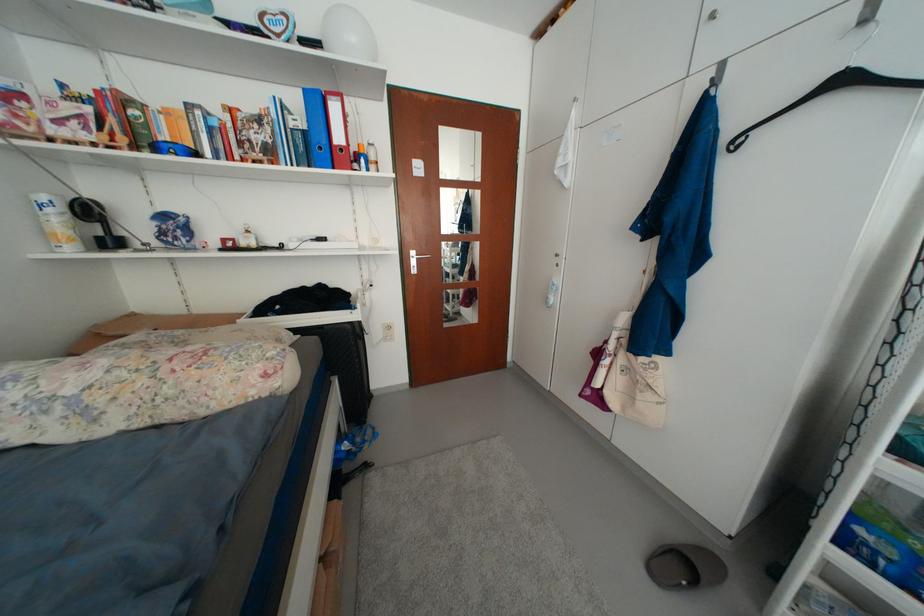
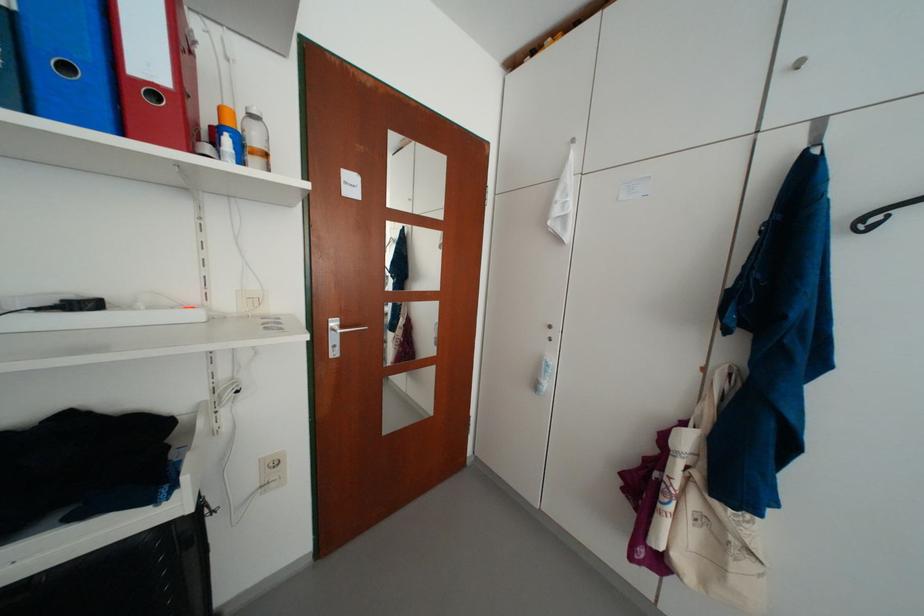
Where in the second image is the point corresponding to the point at 343,169 from the first image?

(130, 136)